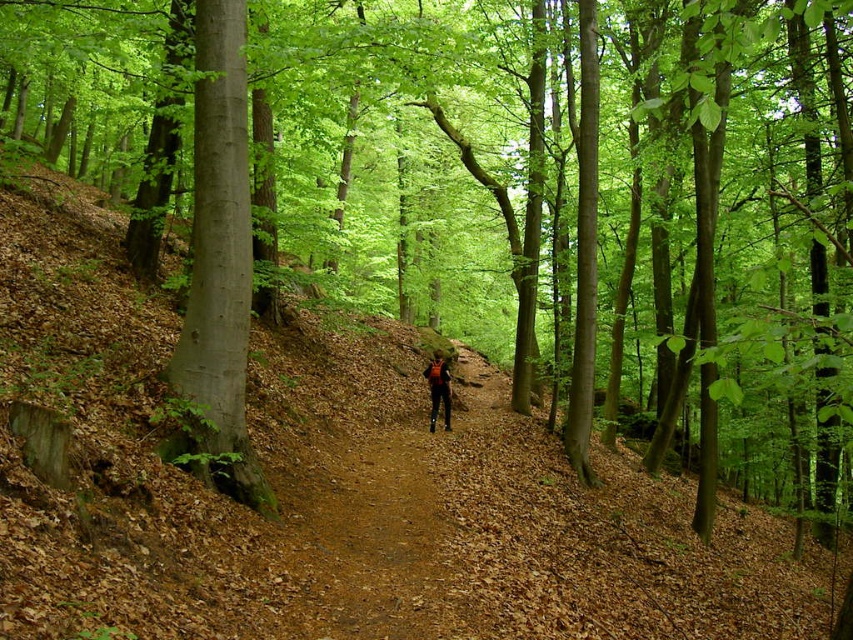
Question: Which of the following is the farthest from the observer?

Choices:
 (A) brown gravel path at center
 (B) smooth gray tree trunk at left
 (C) camouflage fabric backpack at center

Answer: (C)

Question: Which object is positioned closest to the brown gravel path at center?

Choices:
 (A) camouflage fabric backpack at center
 (B) smooth gray tree trunk at left

Answer: (B)

Question: Does brown gravel path at center lie in front of smooth gray tree trunk at left?

Choices:
 (A) no
 (B) yes

Answer: (B)

Question: Is brown gravel path at center thinner than camouflage fabric backpack at center?

Choices:
 (A) no
 (B) yes

Answer: (B)

Question: Is brown gravel path at center further to camera compared to smooth gray tree trunk at left?

Choices:
 (A) no
 (B) yes

Answer: (A)

Question: Considering the real-world distances, which object is farthest from the brown gravel path at center?

Choices:
 (A) camouflage fabric backpack at center
 (B) smooth gray tree trunk at left

Answer: (A)